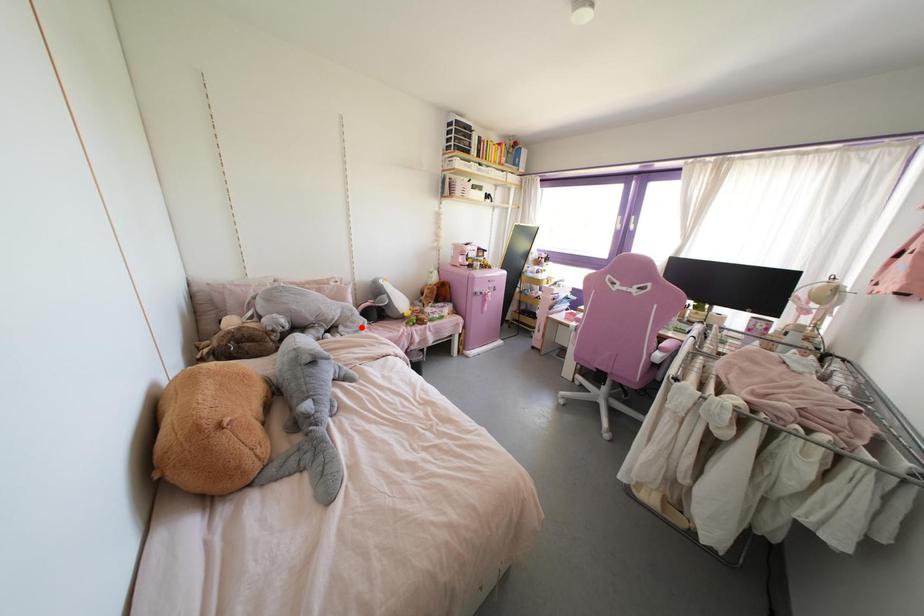
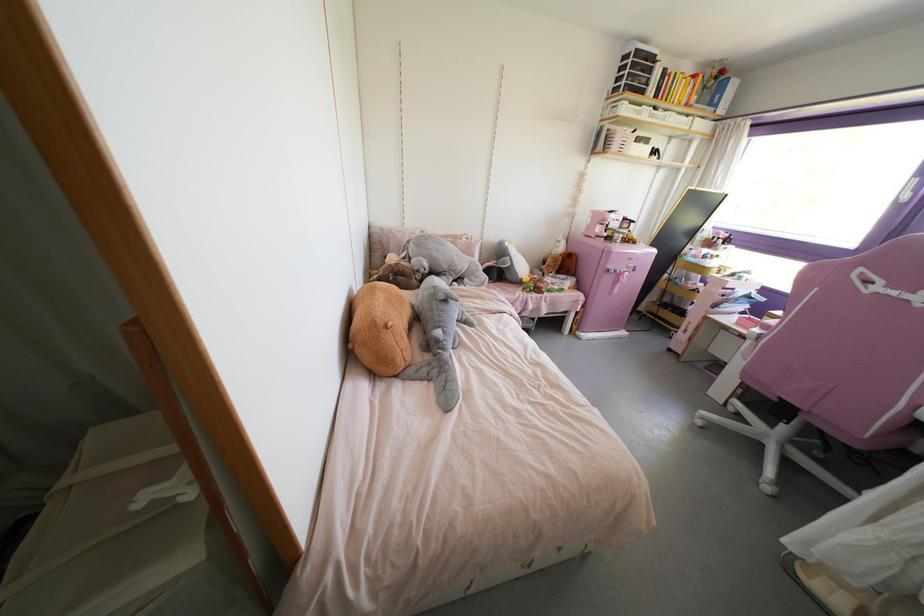
Question: I am providing you with two images of the same scene from different viewpoints. A red point is shown in image1. For the corresponding object point in image2, is it positioned nearer or farther from the camera?

Choices:
 (A) Nearer
 (B) Farther

Answer: (B)